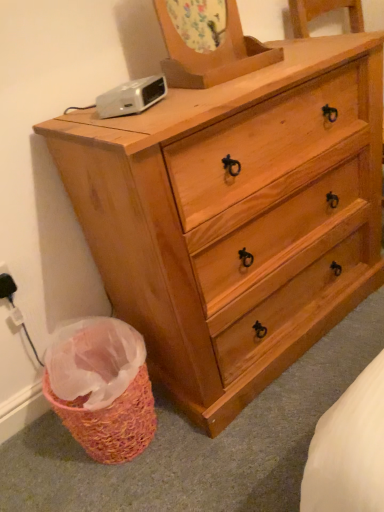
In order to click on vacant space in front of white plastic clock at upper left in this screenshot , I will do `click(138, 122)`.